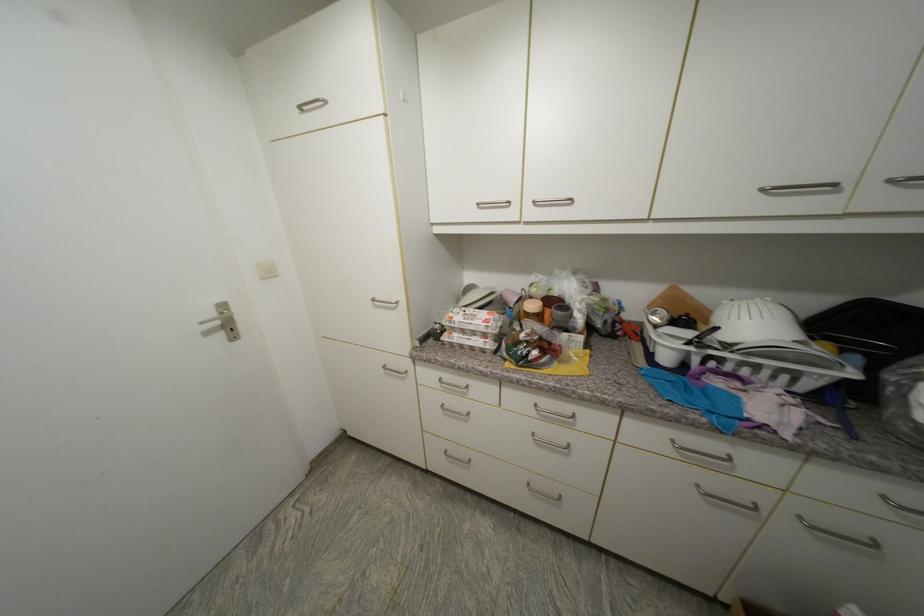
I want to click on silver door handle, so (x=224, y=321).